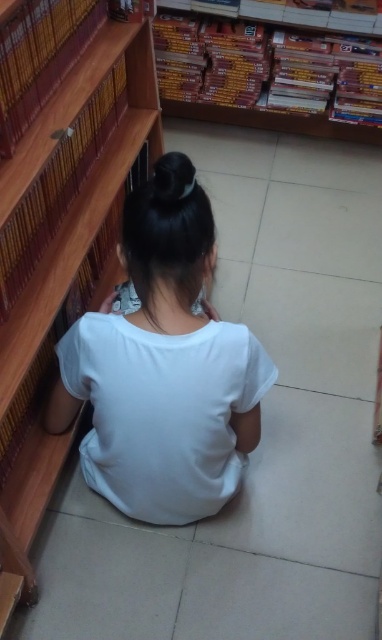
Question: Considering the relative positions of white cotton shirt at center and wooden bookshelf at upper center in the image provided, where is white cotton shirt at center located with respect to wooden bookshelf at upper center?

Choices:
 (A) left
 (B) right

Answer: (A)

Question: Which object is farther from the camera taking this photo?

Choices:
 (A) wooden bookshelf at upper center
 (B) wooden bookshelf at left

Answer: (A)

Question: Which point is farther to the camera?

Choices:
 (A) wooden bookshelf at upper center
 (B) white cotton shirt at center
 (C) wooden bookshelf at left

Answer: (A)

Question: Which point is farther to the camera?

Choices:
 (A) (176, 0)
 (B) (33, 468)
 (C) (202, 426)

Answer: (A)

Question: Is white cotton shirt at center positioned before wooden bookshelf at upper center?

Choices:
 (A) yes
 (B) no

Answer: (A)

Question: Can you confirm if wooden bookshelf at left is smaller than wooden bookshelf at upper center?

Choices:
 (A) no
 (B) yes

Answer: (A)